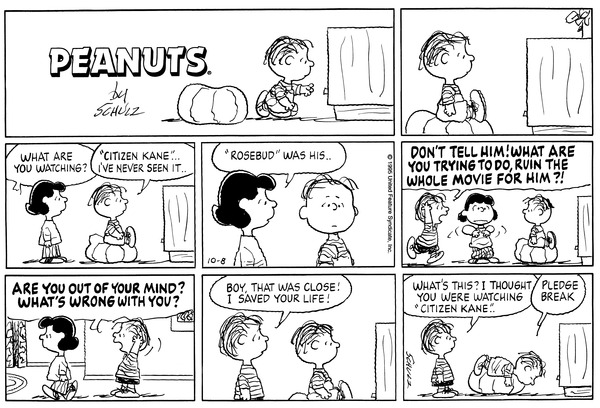
Locate an element on the screen. The height and width of the screenshot is (408, 600). cushion is located at coordinates (108, 251), (212, 100), (424, 118), (529, 253), (489, 383), (299, 397).